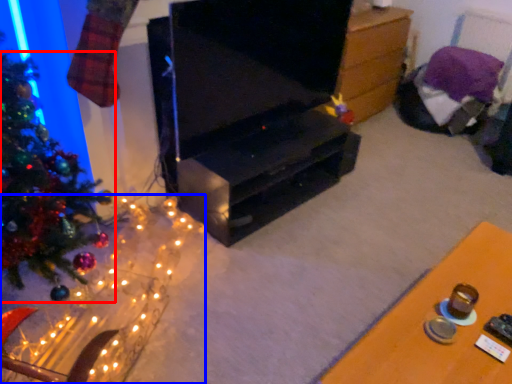
Question: Among these objects, which one is nearest to the camera, christmas tree (highlighted by a red box) or christmas decoration (highlighted by a blue box)?

Choices:
 (A) christmas tree
 (B) christmas decoration

Answer: (B)